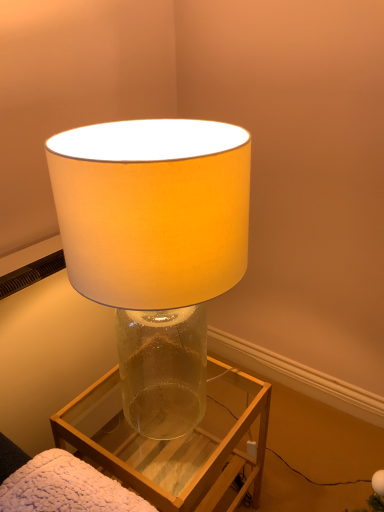
Question: Is point (152, 473) closer or farther from the camera than point (188, 243)?

Choices:
 (A) closer
 (B) farther

Answer: (B)

Question: Is transparent glass vase at center taller or shorter than translucent glass lamp at center?

Choices:
 (A) short
 (B) tall

Answer: (A)

Question: Considering the relative positions of transparent glass vase at center and translucent glass lamp at center in the image provided, is transparent glass vase at center to the left or to the right of translucent glass lamp at center?

Choices:
 (A) left
 (B) right

Answer: (B)

Question: Considering the relative positions of translucent glass lamp at center and transparent glass vase at center in the image provided, is translucent glass lamp at center to the left or to the right of transparent glass vase at center?

Choices:
 (A) left
 (B) right

Answer: (A)

Question: In the image, is translucent glass lamp at center positioned in front of or behind transparent glass vase at center?

Choices:
 (A) behind
 (B) front

Answer: (B)

Question: Is point (122, 204) closer or farther from the camera than point (213, 449)?

Choices:
 (A) closer
 (B) farther

Answer: (A)

Question: Is translucent glass lamp at center taller or shorter than transparent glass vase at center?

Choices:
 (A) short
 (B) tall

Answer: (B)